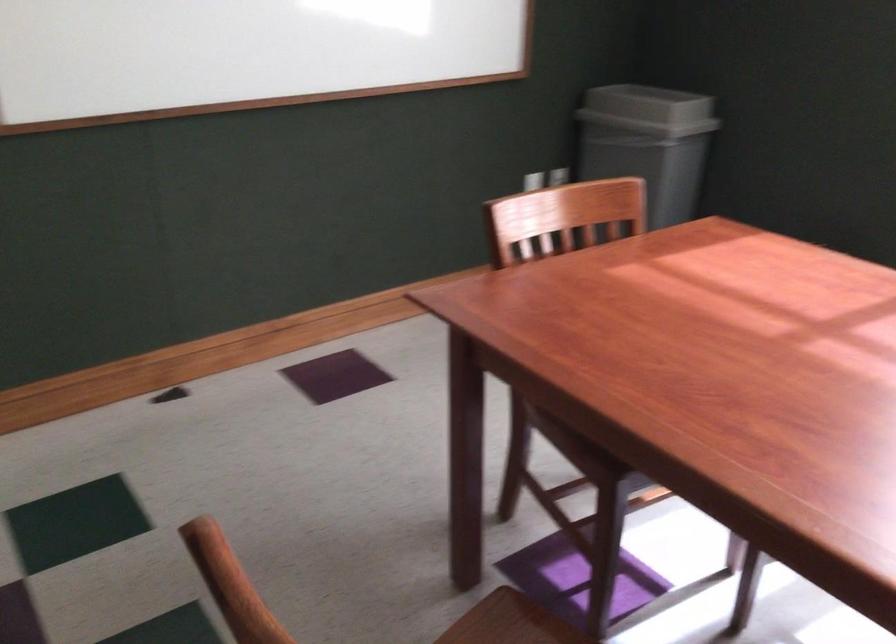
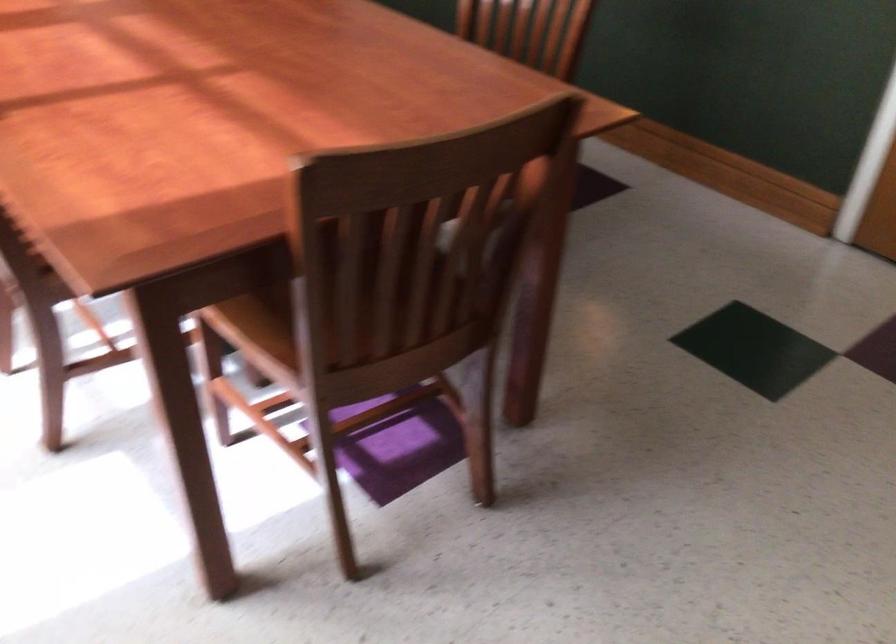
Where in the second image is the point corresponding to [567,569] from the first image?

(398, 447)